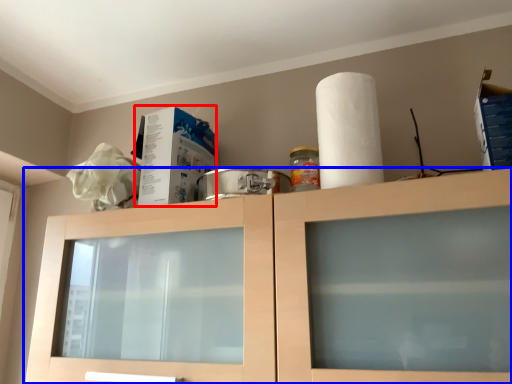
Question: Which object appears farthest to the camera in this image, box (highlighted by a red box) or cabinetry (highlighted by a blue box)?

Choices:
 (A) box
 (B) cabinetry

Answer: (A)